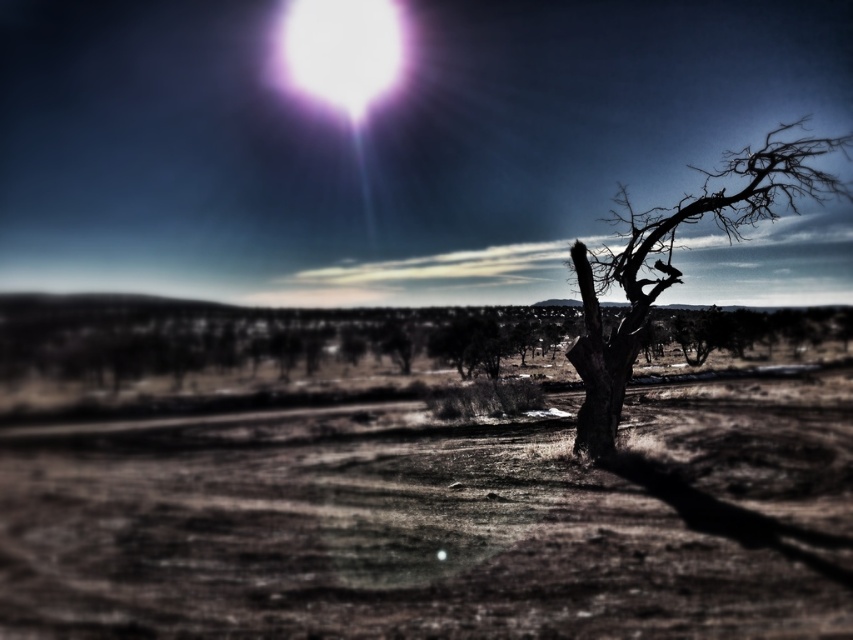
Question: Which of the following is the farthest from the observer?

Choices:
 (A) brown dirt field at center
 (B) bright white orb at upper center
 (C) dark brown bark tree at right

Answer: (B)

Question: Does dark brown bark tree at right appear on the left side of bright white orb at upper center?

Choices:
 (A) yes
 (B) no

Answer: (B)

Question: Is brown dirt field at center thinner than bright white orb at upper center?

Choices:
 (A) no
 (B) yes

Answer: (A)

Question: Which object is farther from the camera taking this photo?

Choices:
 (A) dark brown bark tree at right
 (B) bright white orb at upper center

Answer: (B)

Question: Which point is farther to the camera?

Choices:
 (A) (601, 280)
 (B) (352, 13)
 (C) (289, 612)

Answer: (B)

Question: Can you confirm if brown dirt field at center is thinner than bright white orb at upper center?

Choices:
 (A) yes
 (B) no

Answer: (B)